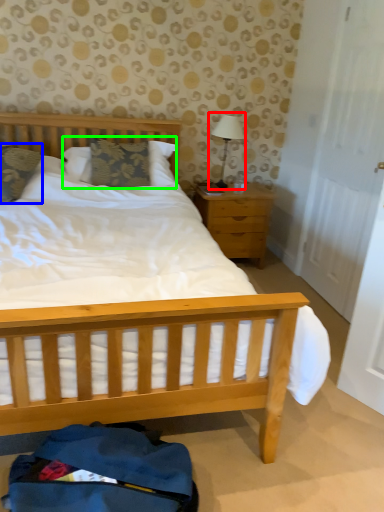
Question: Which object is positioned farthest from table lamp (highlighted by a red box)? Select from pillow (highlighted by a blue box) and pillow (highlighted by a green box).

Choices:
 (A) pillow
 (B) pillow

Answer: (A)